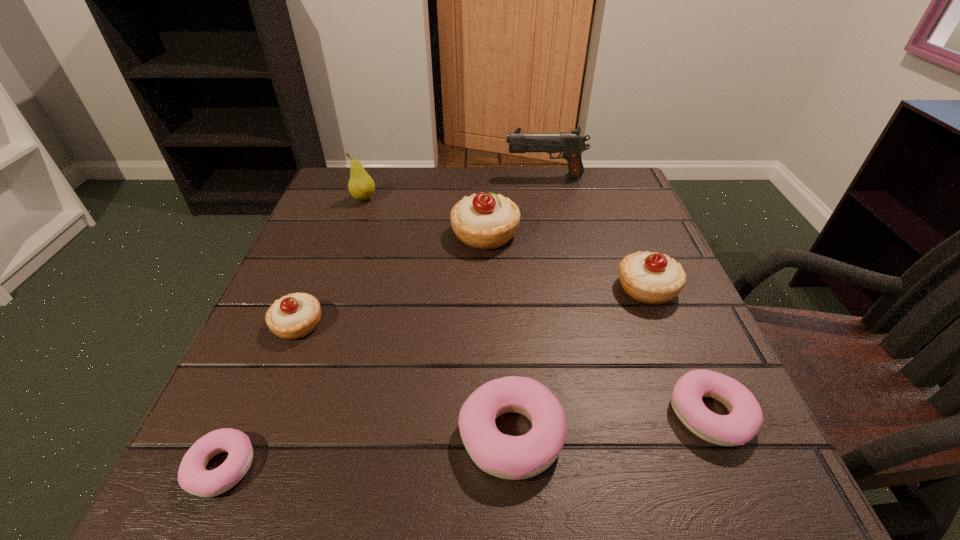
Identify which object is the fifth closest to the sixth shortest object. Please provide its 2D coordinates. Your answer should be formatted as a tuple, i.e. [(x, y)], where the tuple contains the x and y coordinates of a point satisfying the conditions above.

[(509, 457)]

This screenshot has width=960, height=540. I want to click on the sixth closest object to the shortest object, so click(x=652, y=278).

Identify which pastry is the fourth nearest to the farthest pastry. Please provide its 2D coordinates. Your answer should be formatted as a tuple, i.e. [(x, y)], where the tuple contains the x and y coordinates of a point satisfying the conditions above.

[(745, 419)]

This screenshot has width=960, height=540. Identify the location of pastry that stands as the fourth closest to the second beige pastry from left to right. (745, 419).

Point out which beige pastry is positioned as the third nearest to the sixth tallest object. Please provide its 2D coordinates. Your answer should be formatted as a tuple, i.e. [(x, y)], where the tuple contains the x and y coordinates of a point satisfying the conditions above.

[(485, 221)]

I want to click on beige pastry that is the closest to the rightmost beige pastry, so click(x=485, y=221).

Where is `the closest pink pastry relative to the fifth shortest object`? The width and height of the screenshot is (960, 540). the closest pink pastry relative to the fifth shortest object is located at coordinates (745, 419).

Select which pink pastry appears as the second closest to the fifth tallest pastry. Please provide its 2D coordinates. Your answer should be formatted as a tuple, i.e. [(x, y)], where the tuple contains the x and y coordinates of a point satisfying the conditions above.

[(193, 477)]

At what (x,y) coordinates should I click in order to perform the action: click on vacant region that satisfies the following two spatial constraints: 1. in the direction the gray gun is aimed; 2. on the back side of the rightmost beige pastry. Please return your answer as a coordinate pair (x, y). Looking at the image, I should click on (569, 288).

Find the location of a particular element. The height and width of the screenshot is (540, 960). blank area in the image that satisfies the following two spatial constraints: 1. in the direction the gun is aimed; 2. on the right side of the second smallest pink pastry is located at coordinates (597, 415).